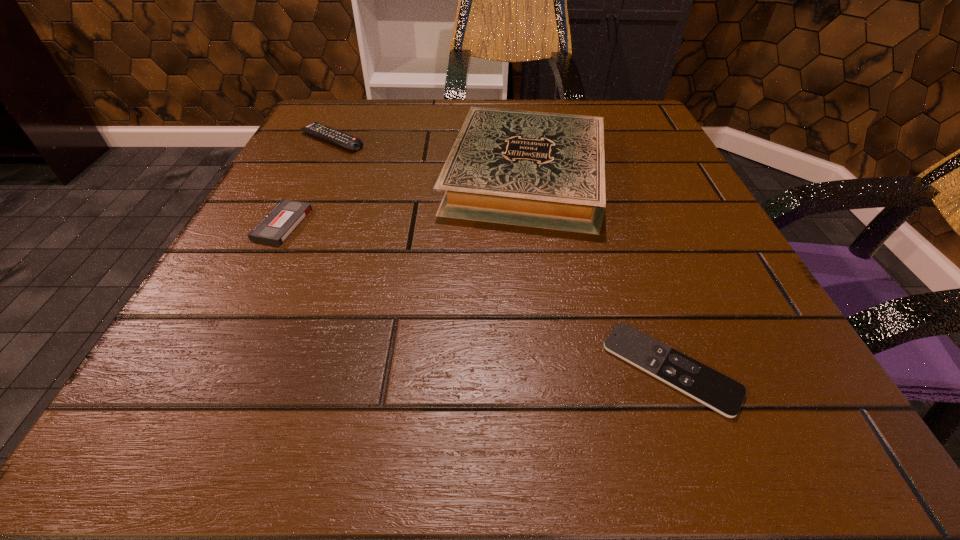
At what (x,y) coordinates should I click in order to perform the action: click on the tallest object. Please return your answer as a coordinate pair (x, y). Looking at the image, I should click on (545, 170).

The height and width of the screenshot is (540, 960). In order to click on the left remote control in this screenshot , I will do `click(346, 141)`.

Locate an element on the screen. The image size is (960, 540). the farther remote control is located at coordinates (346, 141).

Where is `videotape`? videotape is located at coordinates (283, 219).

Where is `the shorter remote control`? Image resolution: width=960 pixels, height=540 pixels. the shorter remote control is located at coordinates (713, 389).

The height and width of the screenshot is (540, 960). In order to click on the right remote control in this screenshot , I will do `click(713, 389)`.

This screenshot has width=960, height=540. Find the location of `free space located on the front of the hardback book`. free space located on the front of the hardback book is located at coordinates (562, 440).

The height and width of the screenshot is (540, 960). I want to click on vacant space located on the right of the farther remote control, so click(514, 140).

Locate an element on the screen. This screenshot has height=540, width=960. vacant space situated on the back of the second shortest object is located at coordinates (334, 123).

Locate an element on the screen. The image size is (960, 540). vacant space situated on the left of the nearest object is located at coordinates (546, 369).